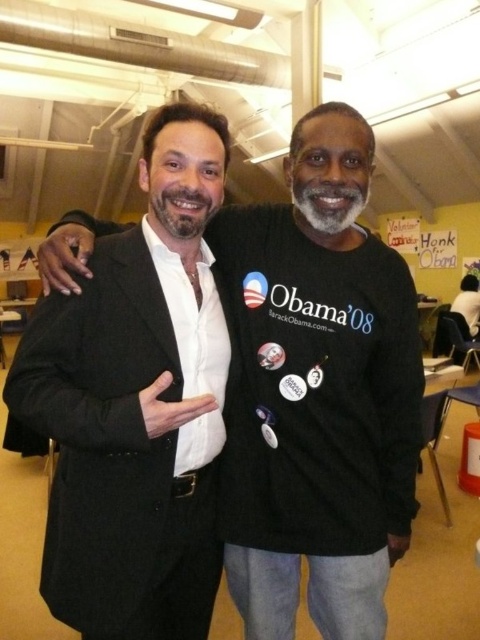
Question: Does matte black suit at center have a greater width compared to black matte suit at left?

Choices:
 (A) yes
 (B) no

Answer: (A)

Question: Is the position of matte black suit at center more distant than that of black matte suit at left?

Choices:
 (A) no
 (B) yes

Answer: (B)

Question: Which point is farther to the camera?

Choices:
 (A) (131, 291)
 (B) (323, 554)

Answer: (B)

Question: Is matte black suit at center thinner than black matte suit at left?

Choices:
 (A) no
 (B) yes

Answer: (A)